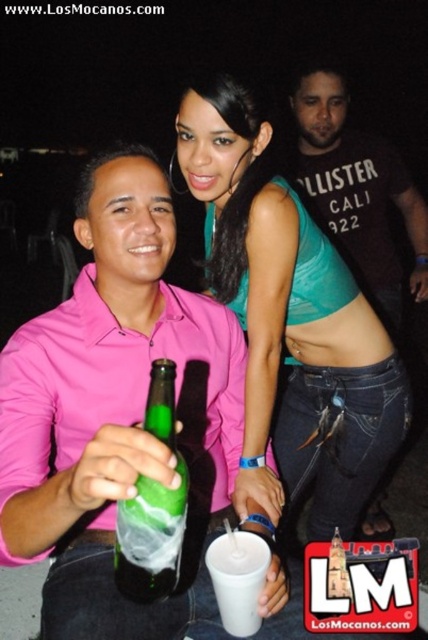
You are at a party and see the matte green glass bottle at center and the white plastic cup at center. Which object is closer to you?

The matte green glass bottle at center is closer to you because it is in front of the white plastic cup at center.

You are a photographer at the party and want to take a photo of the teal fabric top at upper center and the white plastic cup at center. The camera can only focus on objects within 20 inches of each other. Will both objects be in focus?

The distance between the teal fabric top at upper center and the white plastic cup at center is 22.13 inches, which exceeds the 20 inches focus range. Therefore, both objects cannot be in focus simultaneously.